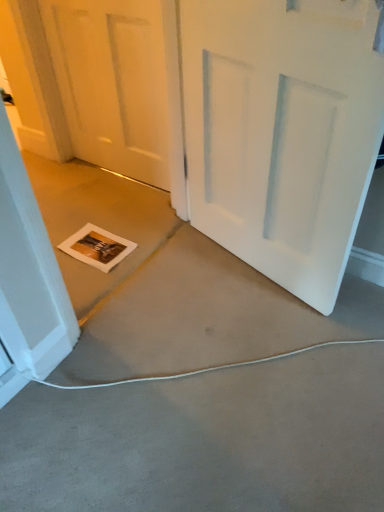
Question: Should I look upward or downward to see white matte door at center, which ranks as the 1th door in right-to-left order?

Choices:
 (A) up
 (B) down

Answer: (A)

Question: Should I look upward or downward to see gray carpet at lower center?

Choices:
 (A) down
 (B) up

Answer: (A)

Question: Is gray carpet at lower center at the back of white matte door at center, which is the 1th door in left-to-right order?

Choices:
 (A) yes
 (B) no

Answer: (B)

Question: Is white matte door at center, acting as the 2th door starting from the right, aimed at gray carpet at lower center?

Choices:
 (A) yes
 (B) no

Answer: (B)

Question: Is white matte door at center, which is the 1th door in left-to-right order, positioned beyond the bounds of gray carpet at lower center?

Choices:
 (A) no
 (B) yes

Answer: (B)

Question: From a real-world perspective, is white matte door at center, acting as the 2th door starting from the right, physically below gray carpet at lower center?

Choices:
 (A) yes
 (B) no

Answer: (B)

Question: Can you confirm if white matte door at center, acting as the 2th door starting from the right, is taller than gray carpet at lower center?

Choices:
 (A) yes
 (B) no

Answer: (A)

Question: Is white matte door at center, which is the 1th door in left-to-right order, wider than gray carpet at lower center?

Choices:
 (A) yes
 (B) no

Answer: (B)

Question: Does white matte door at center, which ranks as the 1th door in right-to-left order, appear on the right side of gray carpet at lower center?

Choices:
 (A) no
 (B) yes

Answer: (B)

Question: Is white matte door at center, the second door positioned from the left, wider than gray carpet at lower center?

Choices:
 (A) no
 (B) yes

Answer: (A)

Question: Is the depth of white matte door at center, the second door positioned from the left, greater than that of gray carpet at lower center?

Choices:
 (A) yes
 (B) no

Answer: (A)

Question: From the image's perspective, is white matte door at center, which ranks as the 1th door in right-to-left order, over gray carpet at lower center?

Choices:
 (A) yes
 (B) no

Answer: (A)

Question: Considering the relative sizes of white matte door at center, which ranks as the 1th door in right-to-left order, and gray carpet at lower center in the image provided, is white matte door at center, which ranks as the 1th door in right-to-left order, smaller than gray carpet at lower center?

Choices:
 (A) yes
 (B) no

Answer: (A)

Question: Does white matte door at center, the second door positioned from the left, have a lesser width compared to gray carpet at lower center?

Choices:
 (A) yes
 (B) no

Answer: (A)

Question: Is white matte door at center, which is the 1th door in left-to-right order, at the back of white matte door at center, which ranks as the 1th door in right-to-left order?

Choices:
 (A) yes
 (B) no

Answer: (B)